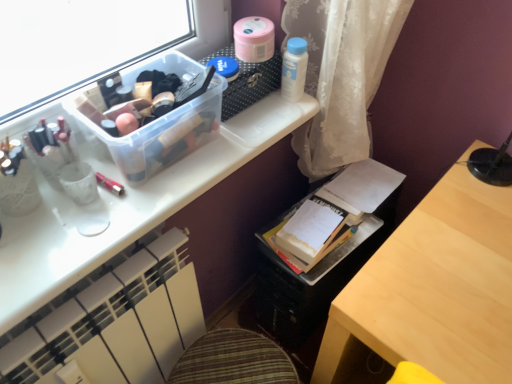
Locate an element on the screen. vacant area that is in front of metallic pink pen at upper left, the first toiletry positioned from the bottom is located at coordinates (79, 234).